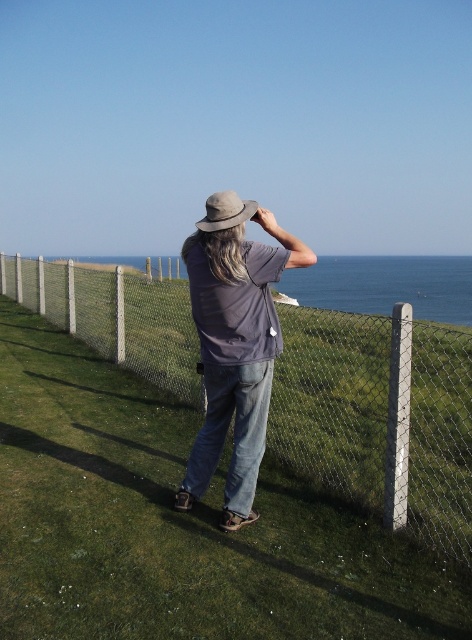
Question: Which object is positioned farthest from the denim jeans at center?

Choices:
 (A) wire mesh fence at center
 (B) light brown felt hat at center

Answer: (A)

Question: Can you confirm if wire mesh fence at center is bigger than light brown felt hat at center?

Choices:
 (A) yes
 (B) no

Answer: (A)

Question: Among these points, which one is nearest to the camera?

Choices:
 (A) (269, 337)
 (B) (218, 193)
 (C) (101, 332)

Answer: (A)

Question: Does wire mesh fence at center appear under denim jeans at center?

Choices:
 (A) yes
 (B) no

Answer: (B)

Question: Considering the relative positions of wire mesh fence at center and denim jeans at center in the image provided, where is wire mesh fence at center located with respect to denim jeans at center?

Choices:
 (A) right
 (B) left

Answer: (A)

Question: Which point is closer to the camera?

Choices:
 (A) (392, 509)
 (B) (260, 221)
 (C) (229, 211)

Answer: (C)